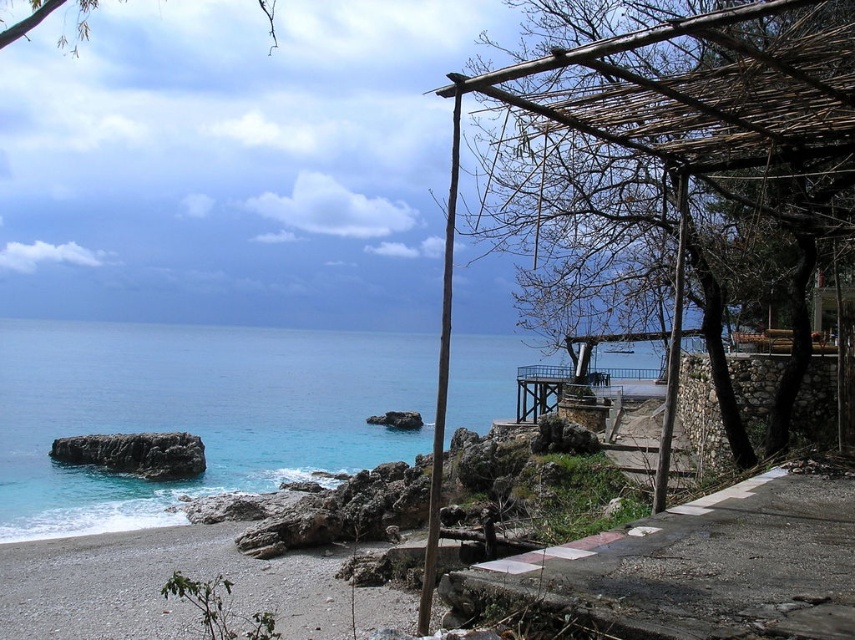
You are a hiker who wants to cross from the wooden structure to the stone wall platform on the right. You notice the gray gravel beach at lower left and the dark gray rock at lower left in your path. Which object should you step on first to ensure a stable path?

You should step on the gray gravel beach at lower left first because its width surpasses that of the dark gray rock at lower left, providing a more stable and wider base for crossing.

You are standing on the beach and notice the blue water at lower left and the dark gray rock at lower left. Which one is higher up from the ground level?

The blue water at lower left is located above the dark gray rock at lower left, so it is higher up from the ground level.

You are standing at the center of the image and want to reach the blue water at lower left. Which direction should you move to get there?

To reach the blue water at lower left, you should move towards the lower left direction since it is located at point (x=195, y=412).